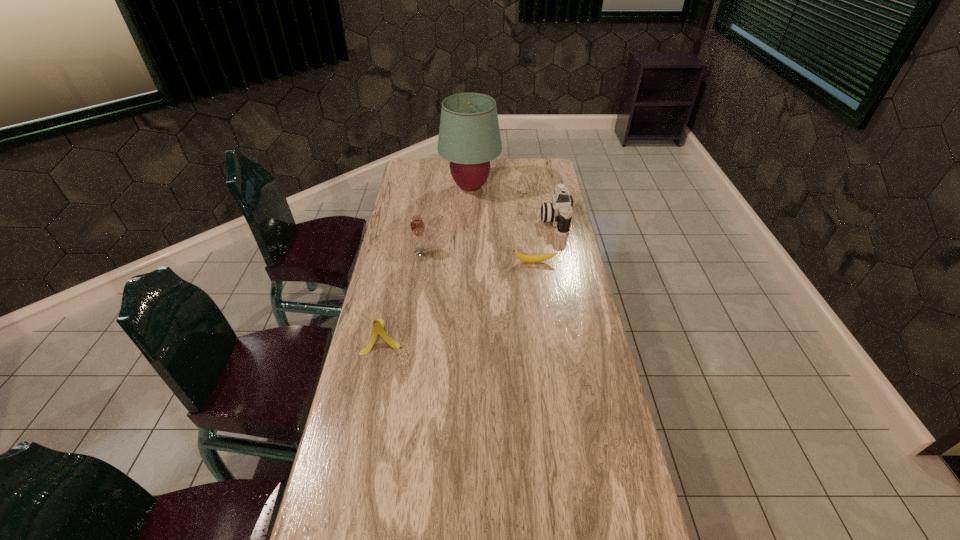
I want to click on blank space located 0.320m on the front of the second tallest object, so click(410, 321).

Locate an element on the screen. This screenshot has height=540, width=960. free space located 0.070m on the back of the camera is located at coordinates (549, 195).

The image size is (960, 540). What are the coordinates of `vacant position located on the right of the nearer banana` in the screenshot? It's located at pyautogui.click(x=502, y=336).

Find the location of `vacant region located on the upward curve of the right banana`. vacant region located on the upward curve of the right banana is located at coordinates (542, 322).

Image resolution: width=960 pixels, height=540 pixels. I want to click on object that is at the far edge, so click(x=469, y=137).

Locate an element on the screen. Image resolution: width=960 pixels, height=540 pixels. wineglass that is at the left edge is located at coordinates (417, 226).

Identify the location of banana present at the left edge. This screenshot has height=540, width=960. (378, 325).

Locate an element on the screen. This screenshot has height=540, width=960. camera that is at the right edge is located at coordinates (559, 212).

Locate an element on the screen. banana present at the right edge is located at coordinates (526, 258).

The image size is (960, 540). In order to click on vacant space at the left edge of the desktop in this screenshot , I will do `click(417, 211)`.